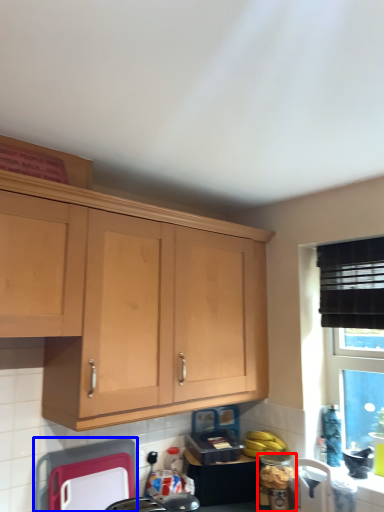
Question: Which object appears closest to the camera in this image, appliance (highlighted by a red box) or appliance (highlighted by a blue box)?

Choices:
 (A) appliance
 (B) appliance

Answer: (B)